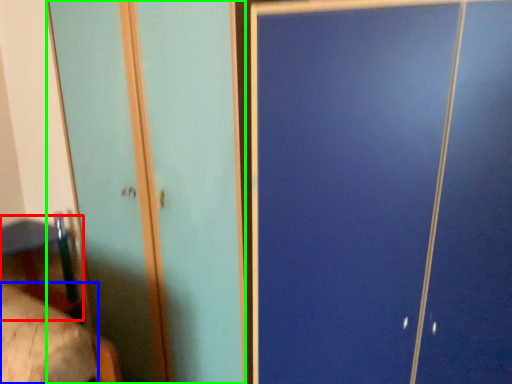
Question: Which object is the farthest from table (highlighted by a red box)? Choose among these: mattress (highlighted by a blue box) or screen door (highlighted by a green box).

Choices:
 (A) mattress
 (B) screen door

Answer: (A)